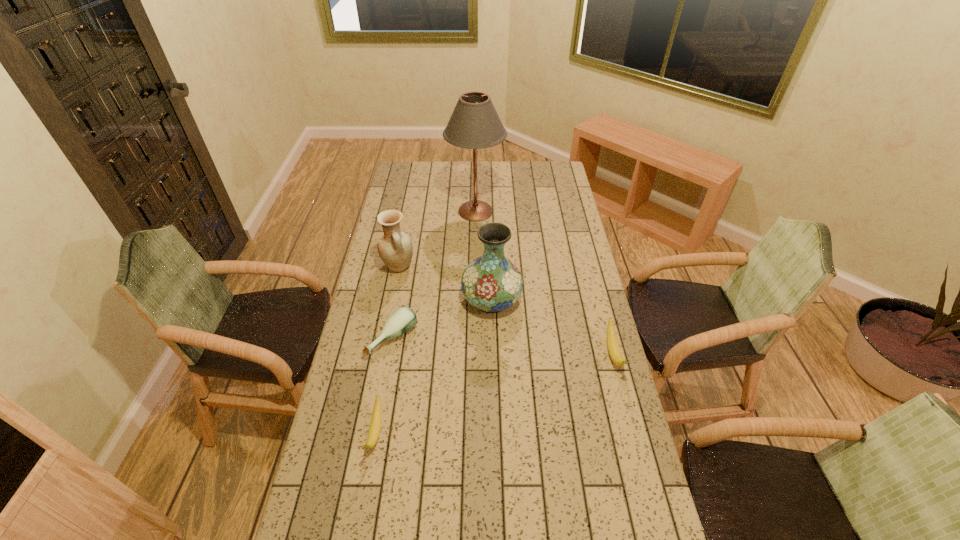
You are a GUI agent. You are given a task and a screenshot of the screen. Output one action in this format:
    pyautogui.click(x=<x>, y=<y>)
    Task: Click on the free area in between the fourth shortest object and the bottle
    The height and width of the screenshot is (540, 960).
    Given the screenshot: What is the action you would take?
    (x=396, y=302)

Locate an element on the screen. Image resolution: width=960 pixels, height=540 pixels. free space between the nearest object and the farther banana is located at coordinates (494, 393).

The image size is (960, 540). I want to click on vacant area that lies between the fifth shortest object and the bottle, so click(x=443, y=319).

Locate which object ranks fourth in proximity to the bottle. Please provide its 2D coordinates. Your answer should be formatted as a tuple, i.e. [(x, y)], where the tuple contains the x and y coordinates of a point satisfying the conditions above.

[(474, 124)]

At what (x,y) coordinates should I click in order to perform the action: click on object that stands as the third closest to the pottery. Please return your answer as a coordinate pair (x, y). The height and width of the screenshot is (540, 960). Looking at the image, I should click on (474, 124).

Where is `vacant position in the image that satisfies the following two spatial constraints: 1. on the front-facing side of the farthest object; 2. at the stem of the nearest object`? vacant position in the image that satisfies the following two spatial constraints: 1. on the front-facing side of the farthest object; 2. at the stem of the nearest object is located at coordinates (473, 432).

Find the location of a particular element. This screenshot has height=540, width=960. vacant space that satisfies the following two spatial constraints: 1. on the front-facing side of the farthest object; 2. on the front side of the bottle is located at coordinates (474, 339).

Where is `free spot that satisfies the following two spatial constraints: 1. on the front-facing side of the table lamp; 2. on the back side of the vase`? This screenshot has width=960, height=540. free spot that satisfies the following two spatial constraints: 1. on the front-facing side of the table lamp; 2. on the back side of the vase is located at coordinates (474, 299).